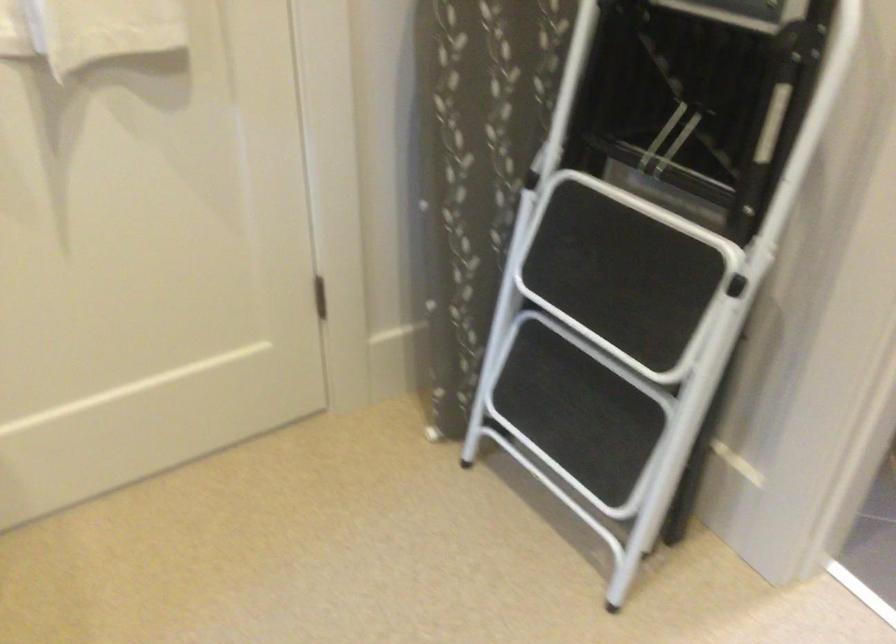
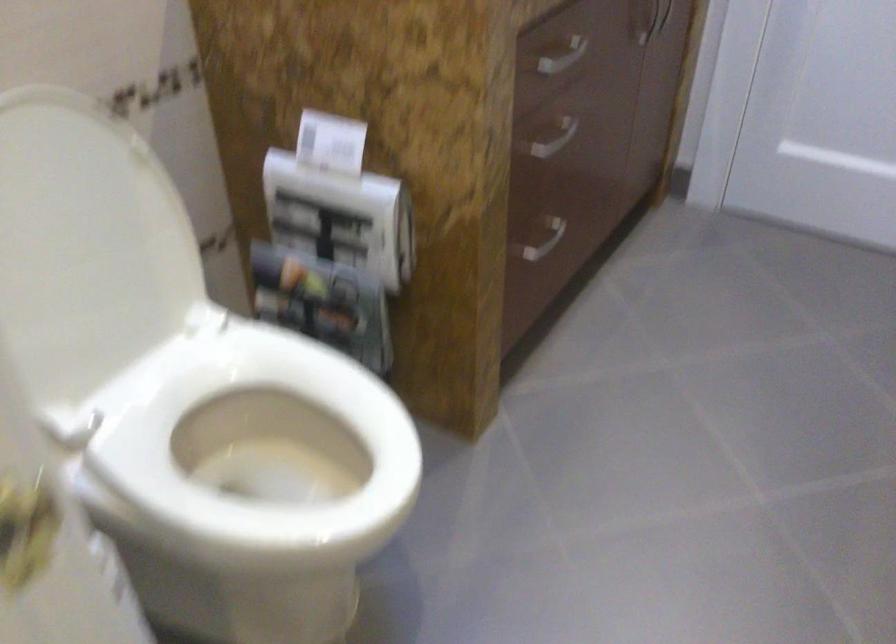
Question: The images are taken continuously from a first-person perspective. In which direction is your viewpoint rotating?

Choices:
 (A) Left
 (B) Right
 (C) Up
 (D) Down

Answer: (B)